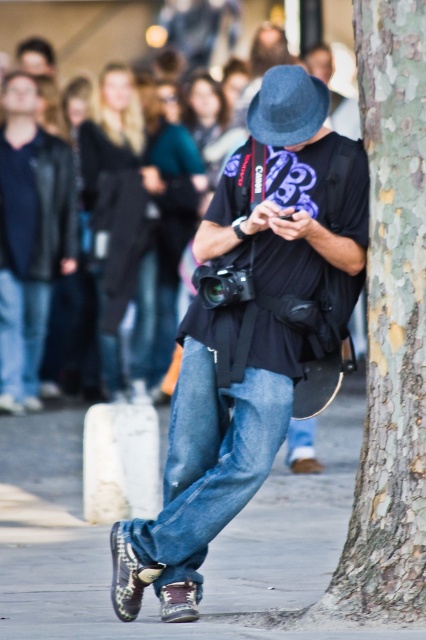
I want to click on matte black jacket at upper left, so click(x=29, y=237).

Who is more distant from viewer, (11, 88) or (106, 49)?

The point (106, 49) is more distant.

At what (x,y) coordinates should I click in order to perform the action: click on matte black jacket at upper left. Please return your answer as a coordinate pair (x, y). Looking at the image, I should click on (29, 237).

Based on the photo, between matte black t-shirt at center and felt gray hat at center, which one has more height?

Standing taller between the two is matte black t-shirt at center.

This screenshot has height=640, width=426. What do you see at coordinates (247, 349) in the screenshot? I see `matte black t-shirt at center` at bounding box center [247, 349].

Where is `matte black t-shirt at center`? This screenshot has height=640, width=426. matte black t-shirt at center is located at coordinates (247, 349).

Can you confirm if matte black t-shirt at center is smaller than denim jeans at center?

No.

Is point (210, 372) less distant than point (94, 51)?

Yes, point (210, 372) is closer to viewer.

At what (x,y) coordinates should I click in order to perform the action: click on matte black t-shirt at center. Please return your answer as a coordinate pair (x, y). Looking at the image, I should click on (247, 349).